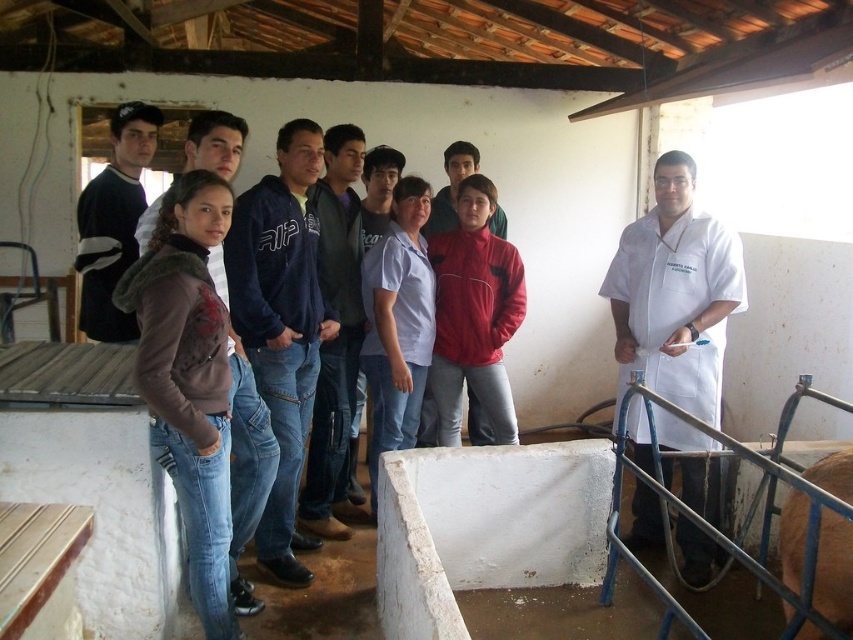
Based on the photo, you are standing at point (267, 548) and want to walk to the exit located at point (650, 307). Is the exit behind you or in front of you?

The exit at point (650, 307) is behind point (267, 548), so the exit is behind you.

Consider the image. You are standing in the middle of the barn and see the blue denim jeans at center. If you walk straight forward, will you hit the jeans?

The blue denim jeans at center are located at point (335, 336) in 2D space. Since you are in the middle of the barn, which is likely the center point of the image, the jeans are slightly to your right and forward. Walking straight forward may not directly lead to the jeans unless your path aligns with their position.